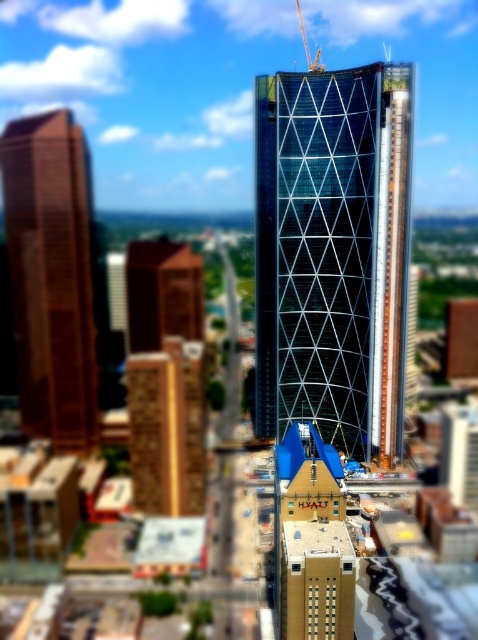
You are a city planner reviewing the architectural plans for the city. You notice the brown polished wood tower at left and the brown textured building at center. Which one is positioned higher in the sky?

The brown polished wood tower at left is above the brown textured building at center, so it is positioned higher in the sky.

You are an architect analyzing the cityscape. You notice the brown polished wood tower at left and the brown wooden tower at center. Which one has a larger footprint in terms of base area?

The brown polished wood tower at left is bigger than brown wooden tower at center, so it has a larger footprint in terms of base area.

You are an architect evaluating the city skyline. You need to determine which structure is taller between the brown polished wood tower at left and the brown textured building at center. Based on the scene, which one is taller?

The brown polished wood tower at left is taller than the brown textured building at center according to the description.